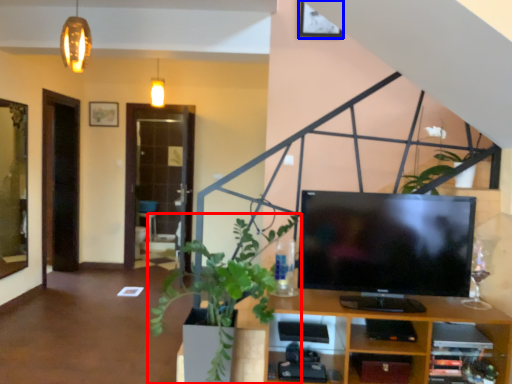
Question: Which object appears farthest to the camera in this image, houseplant (highlighted by a red box) or picture frame (highlighted by a blue box)?

Choices:
 (A) houseplant
 (B) picture frame

Answer: (B)